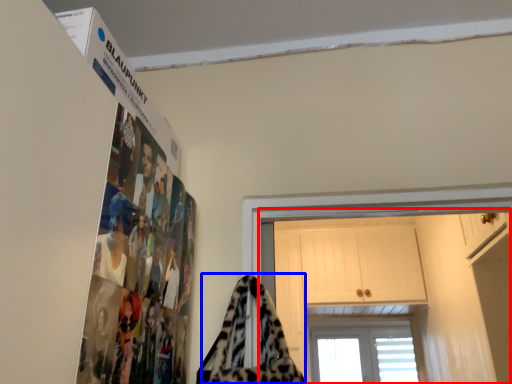
Question: Among these objects, which one is farthest to the camera, dresser (highlighted by a red box) or blanket (highlighted by a blue box)?

Choices:
 (A) dresser
 (B) blanket

Answer: (A)